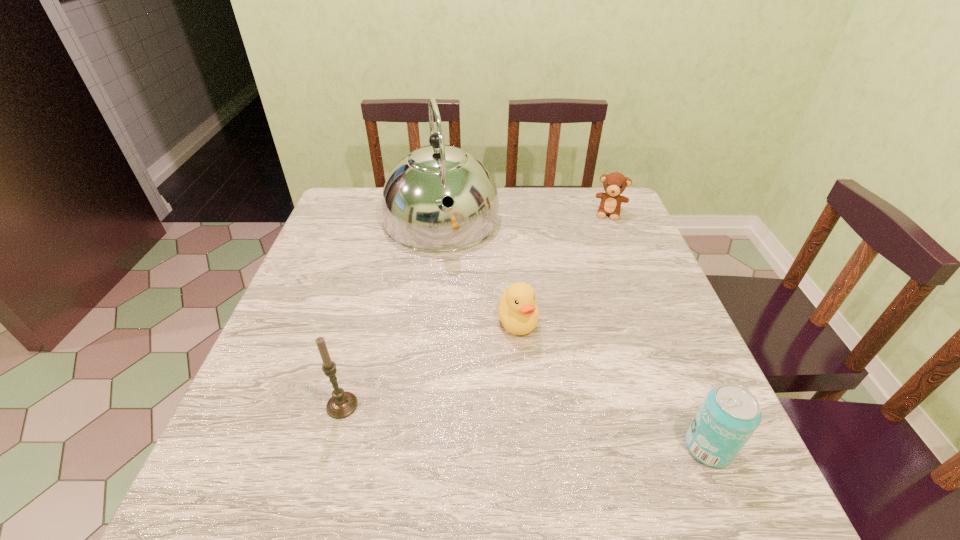
In order to click on the fourth shortest object in this screenshot , I will do (x=342, y=404).

At what (x,y) coordinates should I click in order to perform the action: click on candle. Please return your answer as a coordinate pair (x, y). This screenshot has width=960, height=540. Looking at the image, I should click on (342, 404).

This screenshot has width=960, height=540. What are the coordinates of `beer can` in the screenshot? It's located at (729, 415).

The image size is (960, 540). What are the coordinates of `the third nearest object` in the screenshot? It's located at (518, 312).

This screenshot has height=540, width=960. Identify the location of the tallest object. (414, 217).

The width and height of the screenshot is (960, 540). Identify the location of teddy bear. (614, 184).

Find the location of a particular element. This screenshot has width=960, height=540. free space located 0.230m on the right of the candle is located at coordinates (480, 406).

Find the location of a particular element. The width and height of the screenshot is (960, 540). vacant region located 0.270m on the left of the beer can is located at coordinates (530, 447).

This screenshot has width=960, height=540. I want to click on free space located on the face of the duckling, so click(x=532, y=394).

You are a GUI agent. You are given a task and a screenshot of the screen. Output one action in this format:
    pyautogui.click(x=<x>, y=<y>)
    Task: Click on the free space located 0.060m on the face of the duckling
    
    Given the screenshot: What is the action you would take?
    pyautogui.click(x=526, y=364)